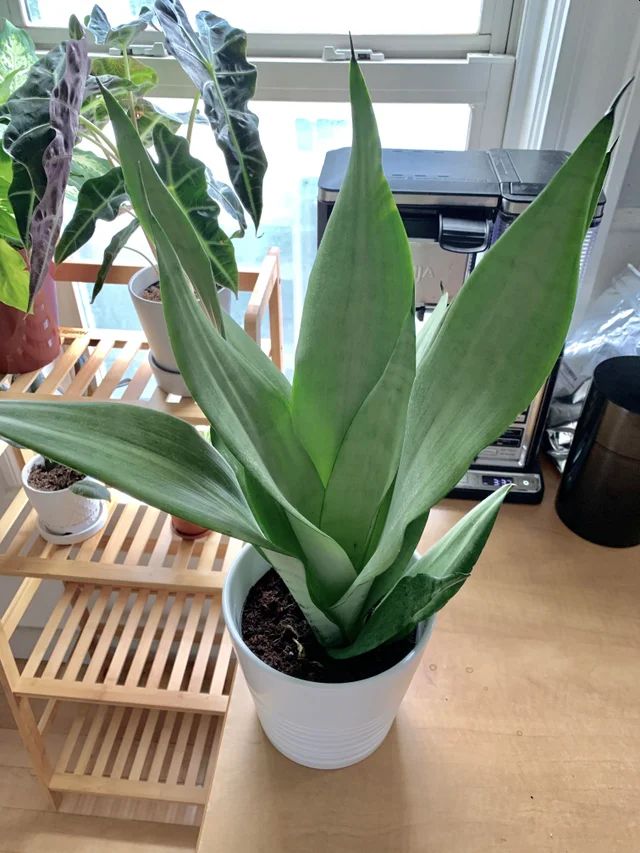
The height and width of the screenshot is (853, 640). In order to click on window in this screenshot , I will do click(299, 136).